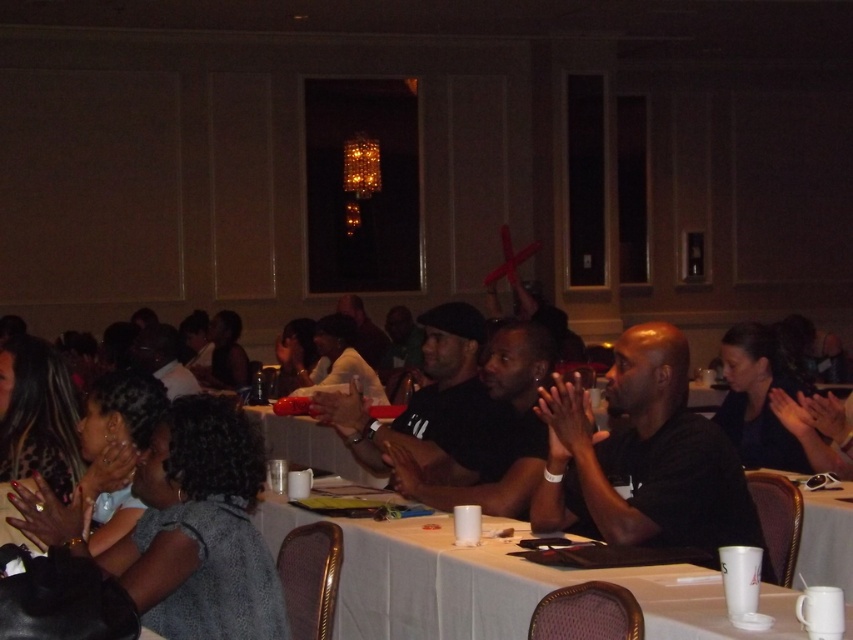
Question: Among these points, which one is nearest to the camera?

Choices:
 (A) (785, 496)
 (B) (572, 422)
 (C) (784, 604)
 (D) (283, 417)

Answer: (C)

Question: Does white paper cup at center appear under white paper cup at lower right?

Choices:
 (A) yes
 (B) no

Answer: (B)

Question: Does white paper cup at center appear on the right side of black matte shirt at center?

Choices:
 (A) no
 (B) yes

Answer: (A)

Question: Which object is positioned closest to the black matte shirt at center?

Choices:
 (A) matte plastic cup at center
 (B) white paper cup at lower right

Answer: (B)

Question: Can you confirm if black matte shirt at center is bigger than matte plastic cup at center?

Choices:
 (A) no
 (B) yes

Answer: (A)

Question: Which point is farther to the camera?

Choices:
 (A) matte plastic cup at center
 (B) white paper cup at lower right
 (C) white paper cup at center
 (D) black matte shirt at center

Answer: (A)